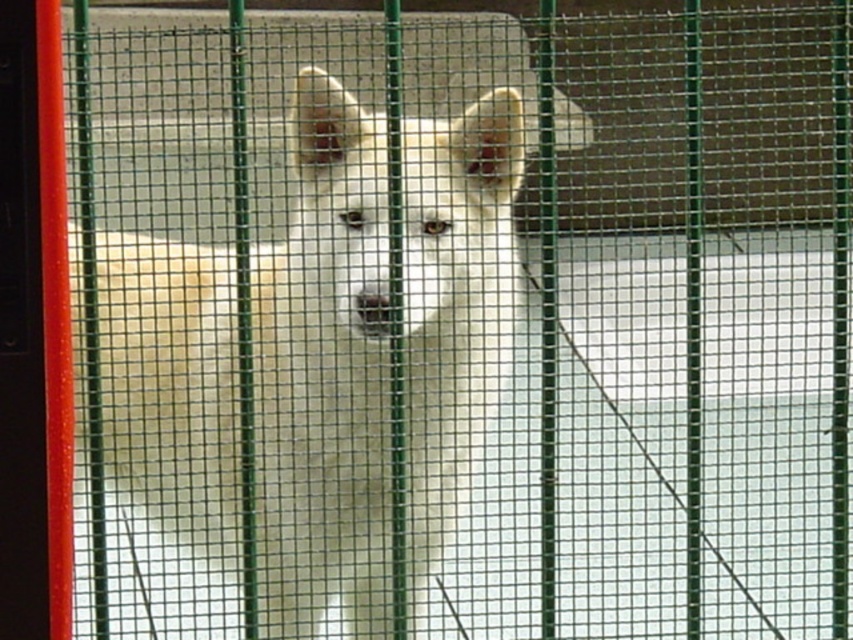
Question: Can you confirm if white fur dog at center is positioned to the right of red plastic screen door at left?

Choices:
 (A) no
 (B) yes

Answer: (B)

Question: Does white fur dog at center have a greater width compared to red plastic screen door at left?

Choices:
 (A) no
 (B) yes

Answer: (B)

Question: Can you confirm if white fur dog at center is positioned above red plastic screen door at left?

Choices:
 (A) no
 (B) yes

Answer: (A)